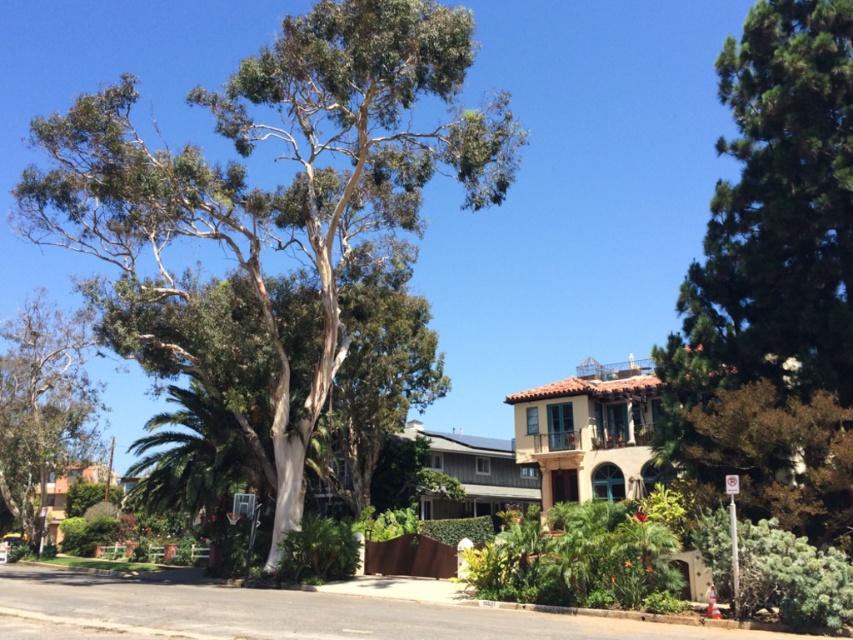
Question: Which object is the farthest from the green textured tree at upper right?

Choices:
 (A) green leafy tree at upper left
 (B) green leafy tree at center

Answer: (B)

Question: Does green leafy tree at upper left have a lesser width compared to green textured tree at upper right?

Choices:
 (A) yes
 (B) no

Answer: (B)

Question: Estimate the real-world distances between objects in this image. Which object is closer to the green textured tree at upper right?

Choices:
 (A) green leafy tree at center
 (B) green leafy tree at upper left

Answer: (B)

Question: Which of the following is the farthest from the observer?

Choices:
 (A) green textured tree at upper right
 (B) green leafy tree at upper left

Answer: (B)

Question: Observing the image, what is the correct spatial positioning of green leafy tree at upper left in reference to green textured tree at upper right?

Choices:
 (A) below
 (B) above

Answer: (B)

Question: Is green leafy tree at upper left to the right of green leafy tree at center from the viewer's perspective?

Choices:
 (A) yes
 (B) no

Answer: (A)